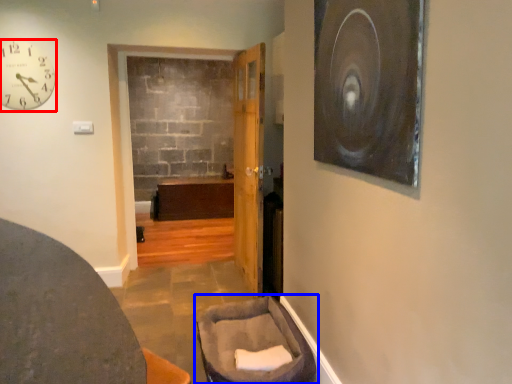
Question: Which object is closer to the camera taking this photo, clock (highlighted by a red box) or furniture (highlighted by a blue box)?

Choices:
 (A) clock
 (B) furniture

Answer: (B)